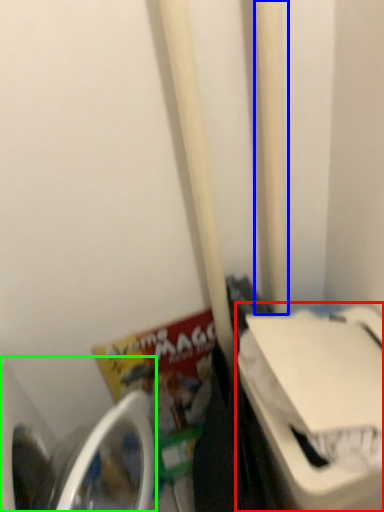
Question: Considering the real-world distances, which object is closest to washing machine (highlighted by a red box)? pole (highlighted by a blue box) or washing machine (highlighted by a green box).

Choices:
 (A) pole
 (B) washing machine

Answer: (A)